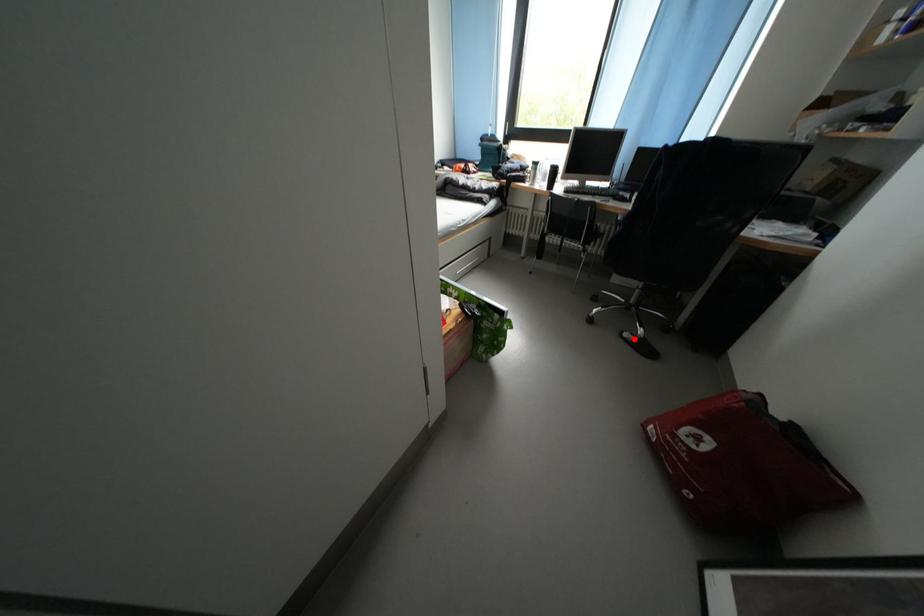
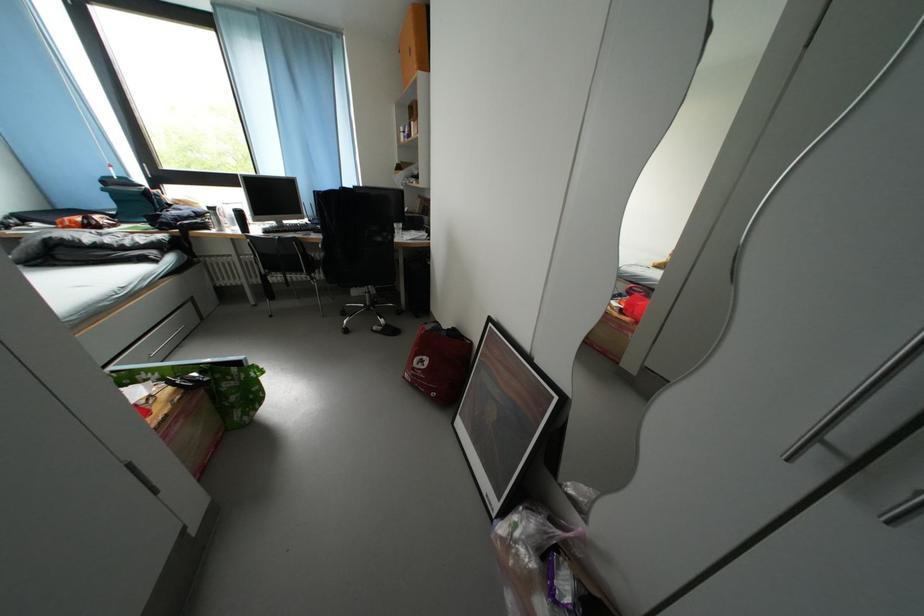
Where in the second image is the point corresponding to the highlighted location from the first image?

(383, 333)